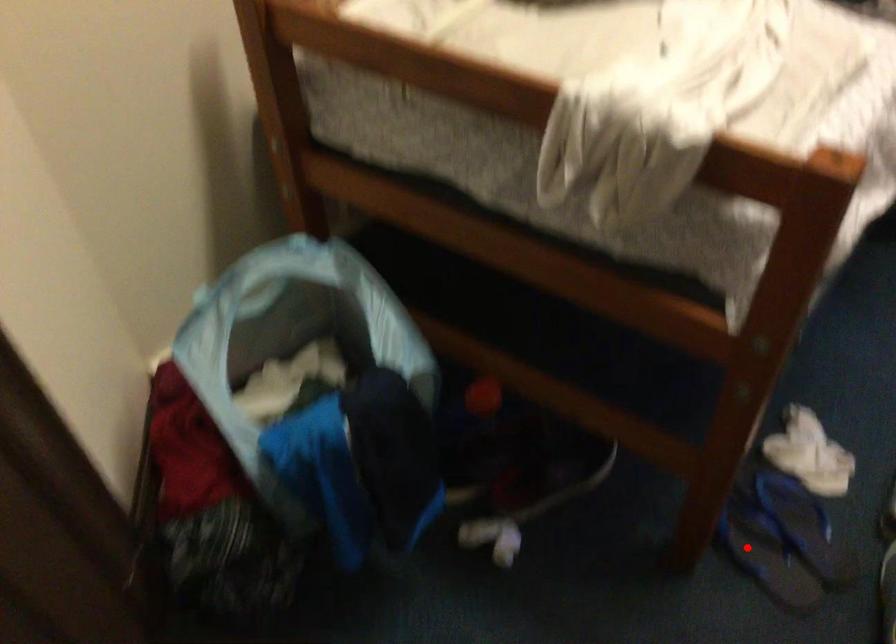
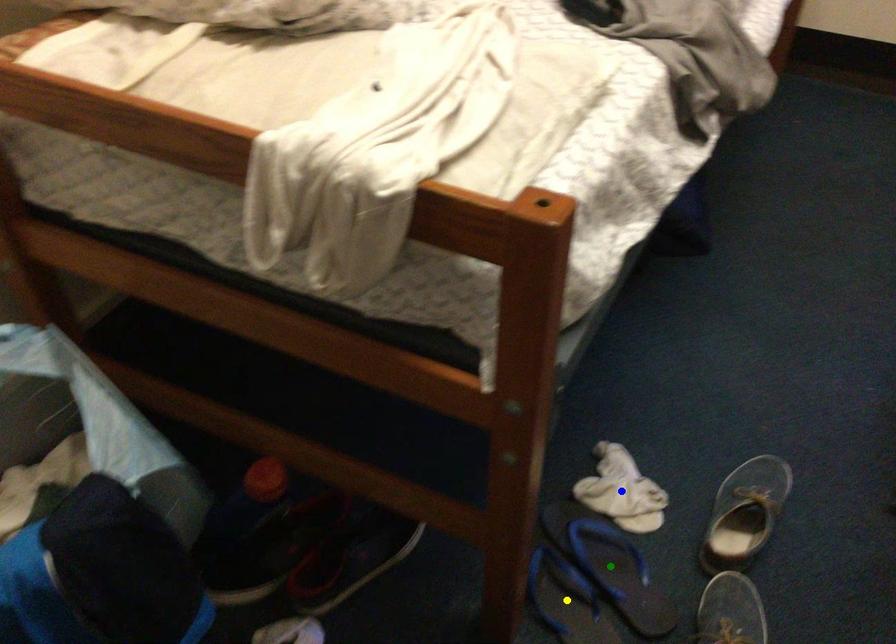
Question: I am providing you with two images of the same scene from different viewpoints. A red point is marked on the first image. You are given multiple points on the second image. Which spot in image 2 lines up with the point in image 1?

Choices:
 (A) blue point
 (B) yellow point
 (C) green point

Answer: (B)